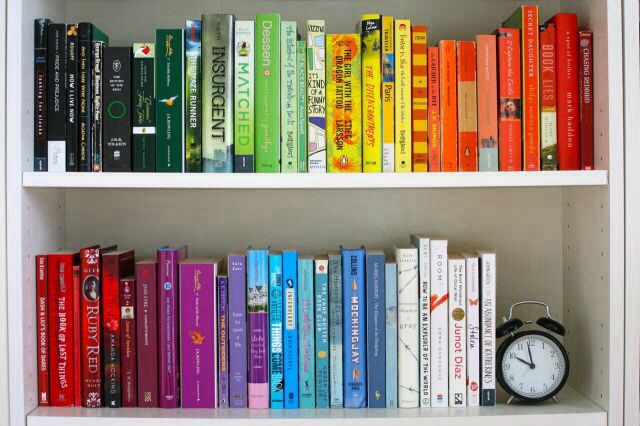
Find the location of a particular element. Image resolution: width=640 pixels, height=426 pixels. purple books is located at coordinates (145, 345), (162, 349), (193, 352), (221, 357), (233, 346), (257, 352).